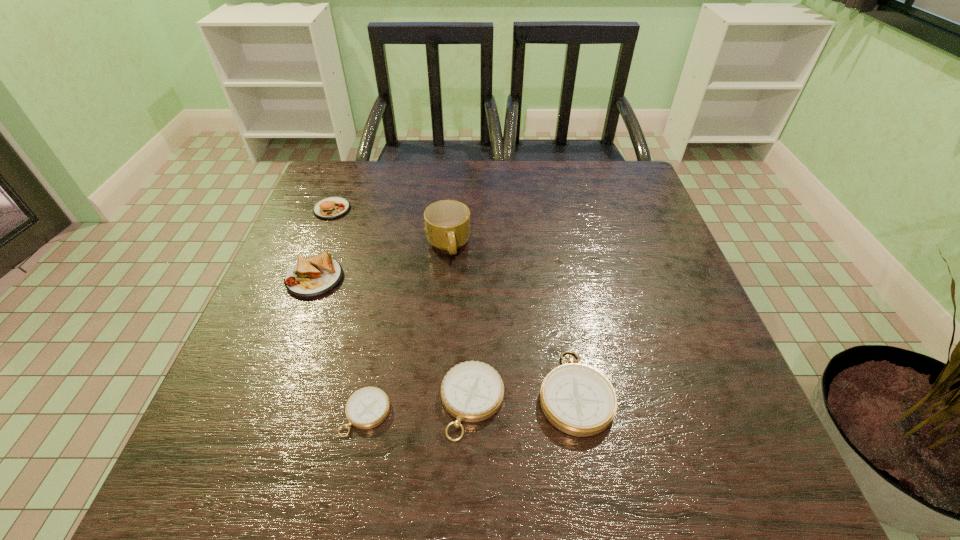
Locate an element on the screen. Image resolution: width=960 pixels, height=540 pixels. free space at the near edge is located at coordinates (438, 423).

Where is `free space at the left edge of the desktop`? This screenshot has width=960, height=540. free space at the left edge of the desktop is located at coordinates (323, 241).

You are a GUI agent. You are given a task and a screenshot of the screen. Output one action in this format:
    pyautogui.click(x=<x>, y=<y>)
    Task: Click on the free point at the right edge
    This screenshot has height=540, width=960.
    Given the screenshot: What is the action you would take?
    pyautogui.click(x=667, y=295)

Identify the location of vacant space at the far left corner. (372, 191).

Where is `vacant space at the far right corner of the desktop`? Image resolution: width=960 pixels, height=540 pixels. vacant space at the far right corner of the desktop is located at coordinates (594, 175).

I want to click on vacant space in between the tallest object and the farthest object, so click(390, 227).

Where is `free space between the fifth tallest object and the rightmost object`? The width and height of the screenshot is (960, 540). free space between the fifth tallest object and the rightmost object is located at coordinates (523, 397).

Locate an element on the screen. The image size is (960, 540). free space between the second shortest object and the sandwich is located at coordinates (394, 340).

You are a GUI agent. You are given a task and a screenshot of the screen. Output one action in this format:
    pyautogui.click(x=<x>, y=<y>)
    Task: Click on the empty location between the rightmost object and the mug
    This screenshot has height=540, width=960.
    Given the screenshot: What is the action you would take?
    pyautogui.click(x=512, y=319)

Identify the location of free space between the patty and the sandwich. (324, 244).